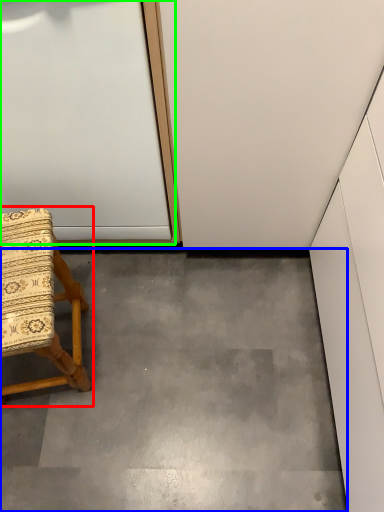
Question: Which object is positioned closest to chair (highlighted by a red box)? Select from concrete (highlighted by a blue box) and door (highlighted by a green box).

Choices:
 (A) concrete
 (B) door

Answer: (B)